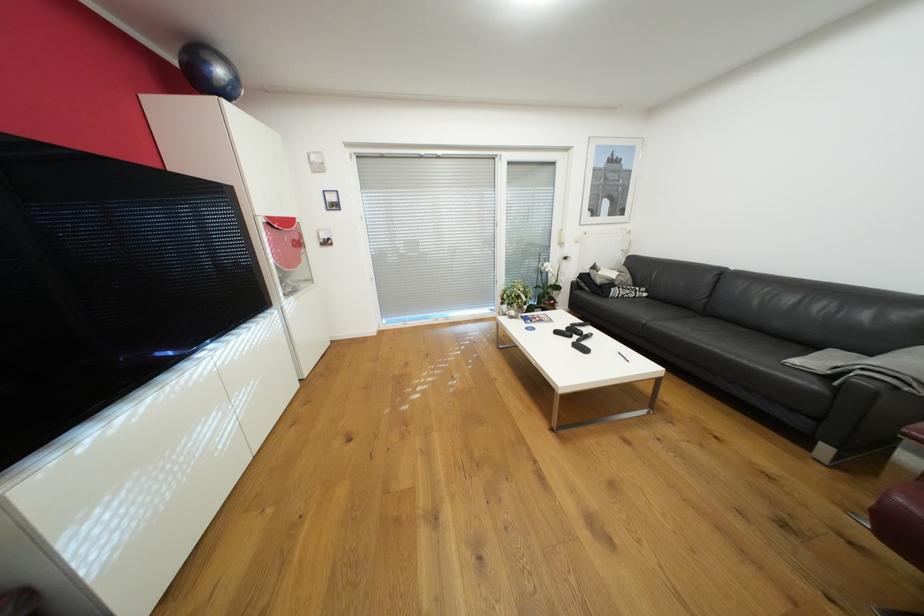
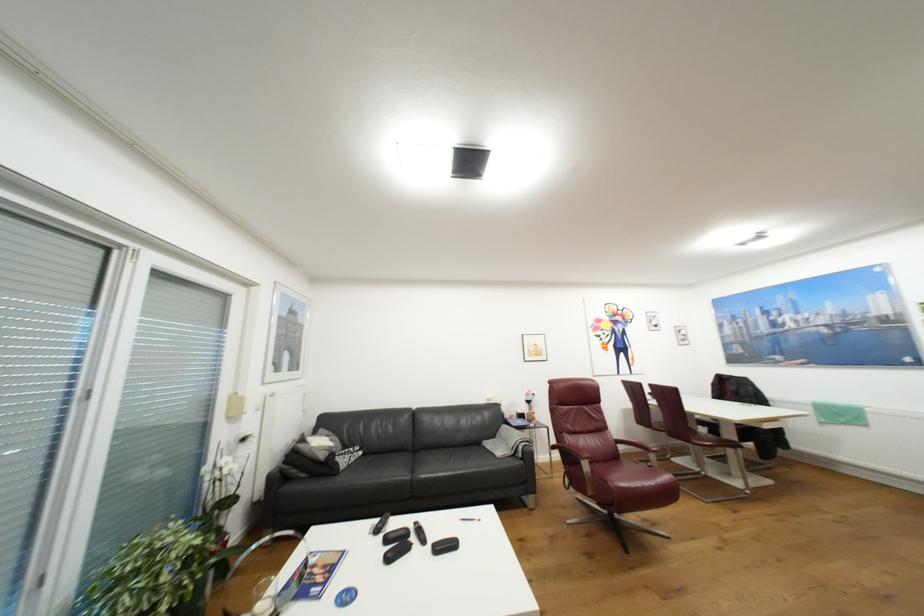
Where in the second image is the point corresponding to (x=601, y=267) from the first image?

(309, 440)